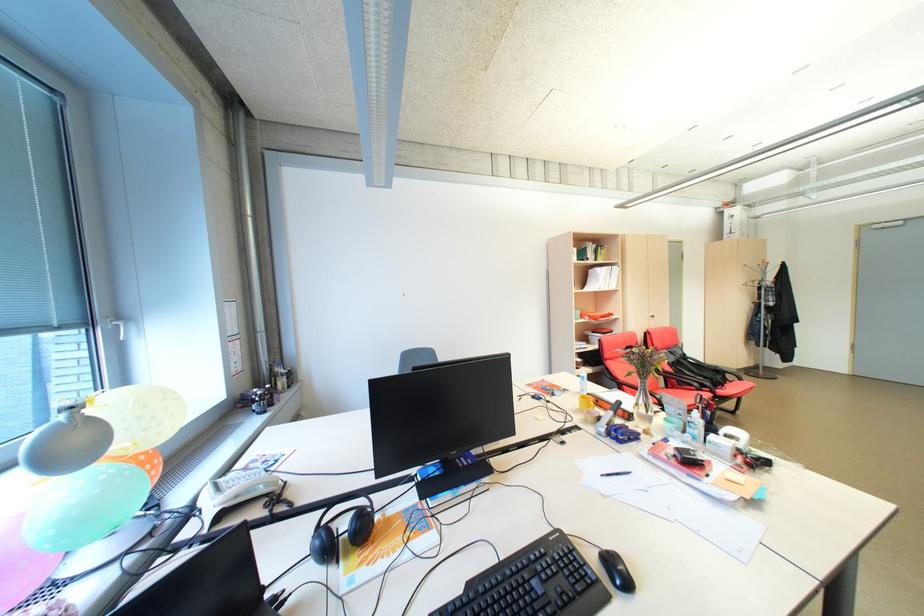
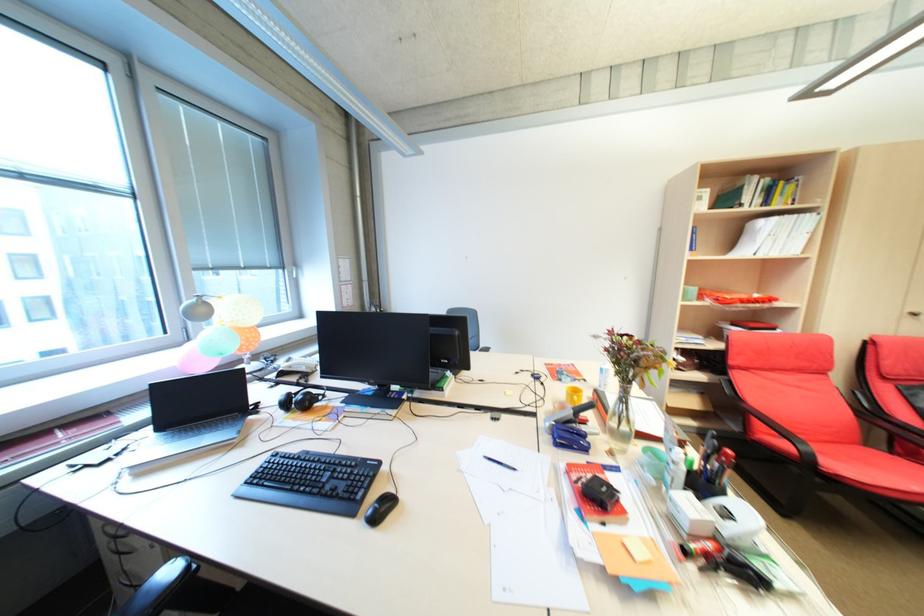
Find the pixel in the second image that matches point (590, 402) in the first image.

(577, 392)